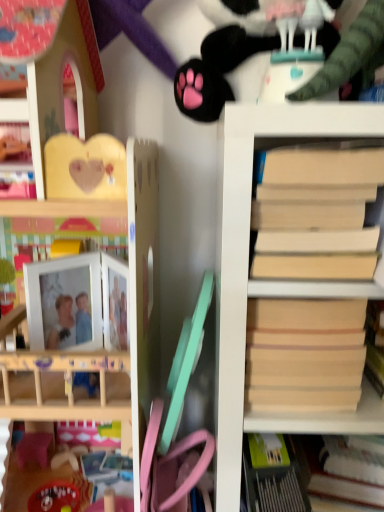
Question: From a real-world perspective, is wooden dollhouse at upper left, the 2th shelf from the right, positioned above or below beige cardboard book at right?

Choices:
 (A) above
 (B) below

Answer: (B)

Question: Visually, is wooden dollhouse at upper left, the 2th shelf from the right, positioned to the left or to the right of beige cardboard book at right?

Choices:
 (A) left
 (B) right

Answer: (A)

Question: Considering the real-world distances, which object is farthest from the wooden dollhouse at upper left, acting as the 1th shelf starting from the left?

Choices:
 (A) beige matte paper at right
 (B) beige cardboard book at right
 (C) light beige wood bookshelf at right, which is the first shelf from right to left
 (D) black plush paw at upper center

Answer: (A)

Question: Which of these objects is positioned farthest from the black plush paw at upper center?

Choices:
 (A) beige matte paper at right
 (B) light beige wood bookshelf at right, which is the first shelf from right to left
 (C) beige cardboard book at right
 (D) wooden dollhouse at upper left, acting as the 1th shelf starting from the left

Answer: (A)